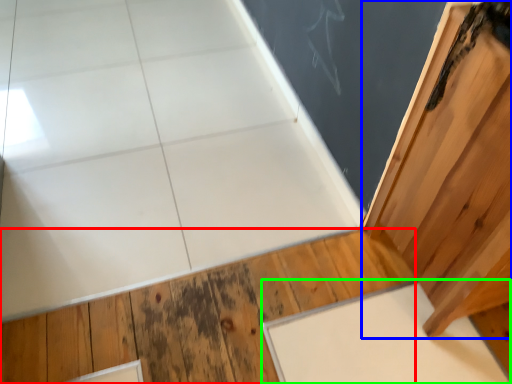
Question: Which is nearer to the hardwood (highlighted by a red box)? door (highlighted by a blue box) or slate (highlighted by a green box).

Choices:
 (A) door
 (B) slate

Answer: (B)